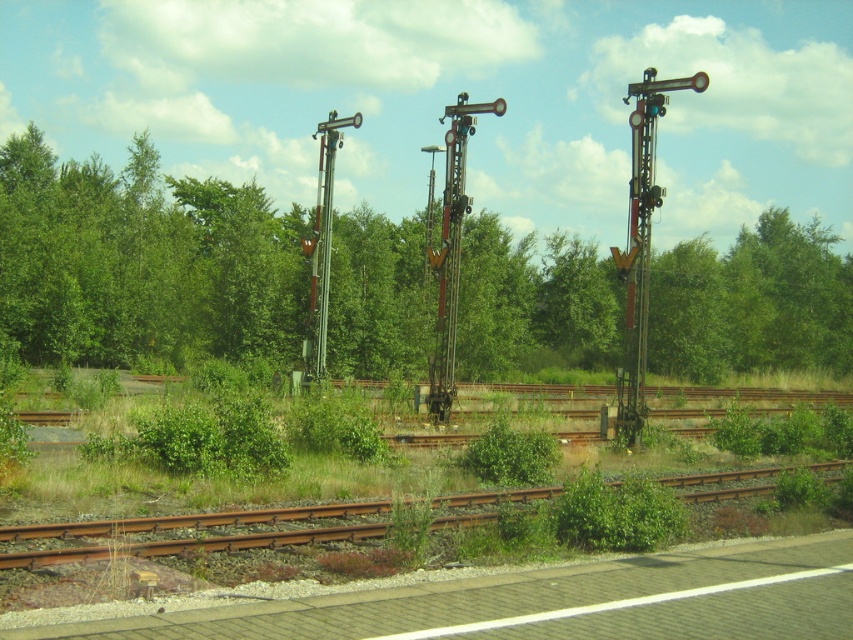
You are standing at the origin point of the image. Which direction should you walk to reach the green leafy trees at center?

You should walk towards the direction of the green leafy trees at center located at point 0.411 on the x axis and 0.168 on the y axis.

You are a railway engineer inspecting the area. You need to determine if the green leafy trees at center will block the view of the rusty metal train track at lower center. Based on their heights, what is your assessment?

The green leafy trees at center is much taller than the rusty metal train track at lower center, so they will block the view of the rusty metal train track at lower center.